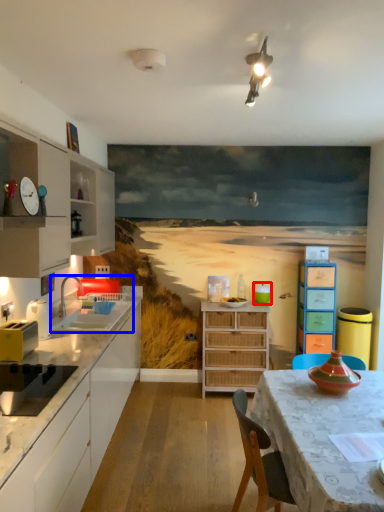
Question: Which point is further to the camera, appliance (highlighted by a red box) or sink (highlighted by a blue box)?

Choices:
 (A) appliance
 (B) sink

Answer: (A)